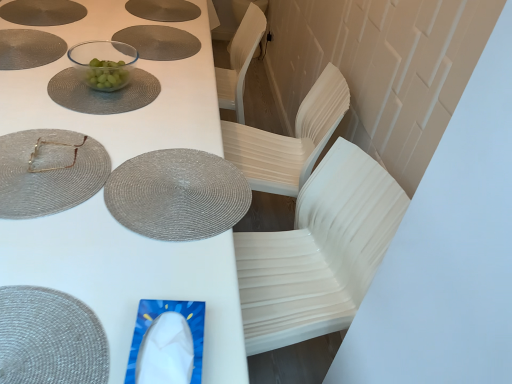
Where is `unoccupied area in front of transparent glass bowl at upper center, the 1th glass plate positioned from the top`? unoccupied area in front of transparent glass bowl at upper center, the 1th glass plate positioned from the top is located at coordinates (93, 127).